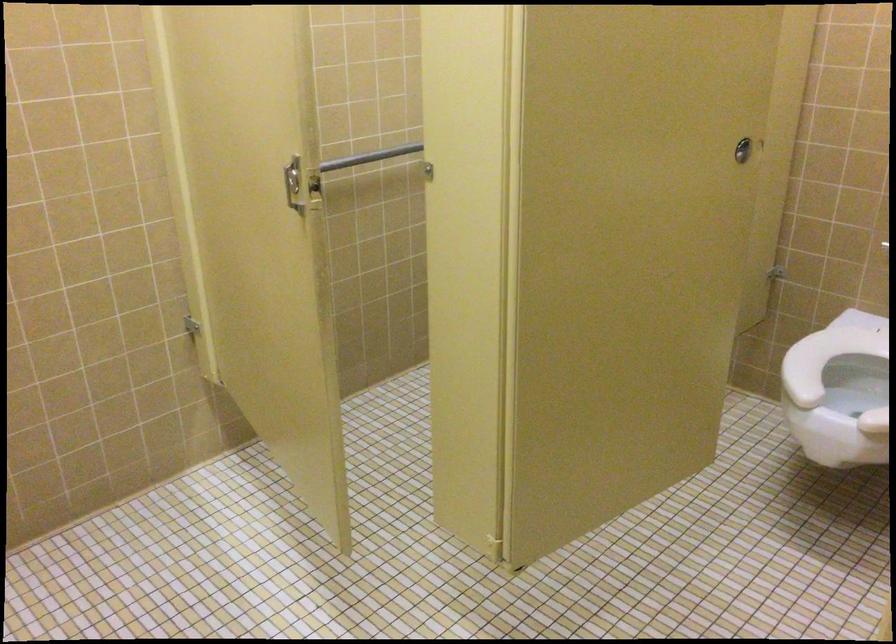
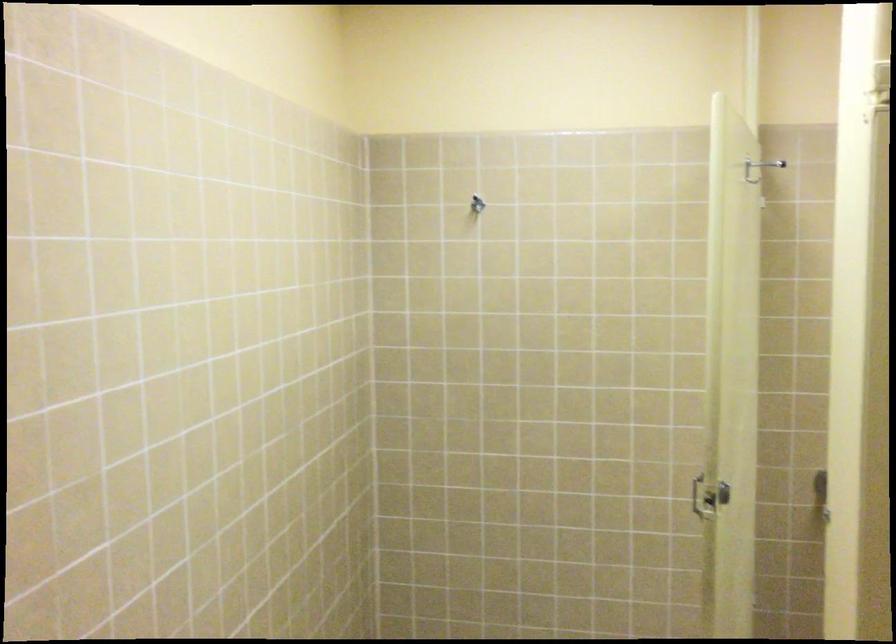
Question: The camera is either moving clockwise (left) or counter-clockwise (right) around the object. The first image is from the beginning of the video and the second image is from the end. Is the camera moving left or right when shooting the video?

Choices:
 (A) Left
 (B) Right

Answer: (B)